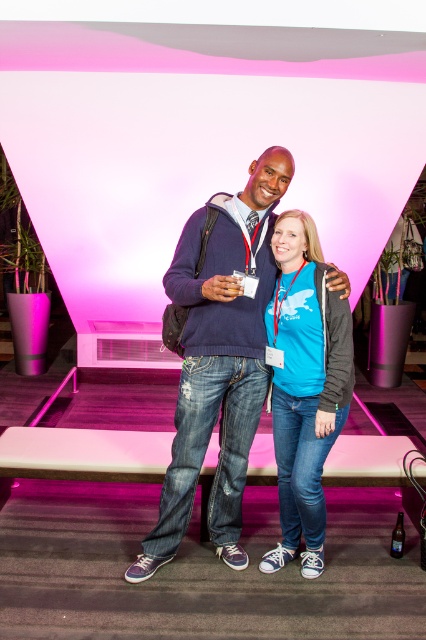
Is the position of denim jeans at center less distant than that of blue cotton t-shirt at center?

Yes, denim jeans at center is closer to the viewer.

Does denim jeans at center appear on the right side of blue cotton t-shirt at center?

In fact, denim jeans at center is to the left of blue cotton t-shirt at center.

Between point (201, 406) and point (287, 253), which one is positioned in front?

Point (201, 406) is in front.

This screenshot has width=426, height=640. I want to click on denim jeans at center, so click(218, 358).